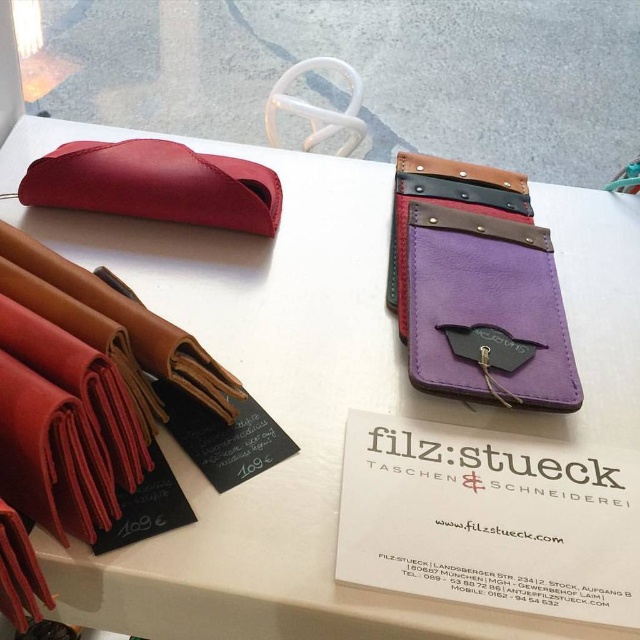
Which is below, purple leather wallet at upper right or matte leather pouch at upper left?

purple leather wallet at upper right is lower down.

Is purple leather wallet at upper right bigger than matte leather pouch at upper left?

Indeed, purple leather wallet at upper right has a larger size compared to matte leather pouch at upper left.

In order to click on purple leather wallet at upper right in this screenshot , I will do `click(477, 285)`.